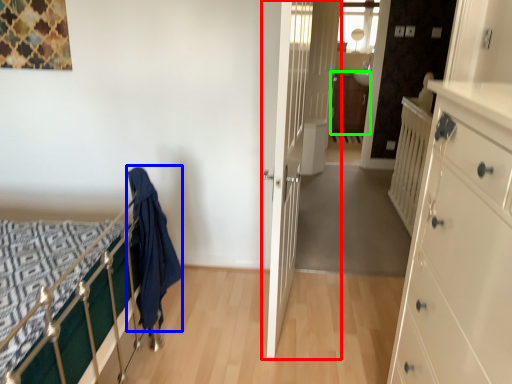
Question: Estimate the real-world distances between objects in this image. Which object is closer to door (highlighted by a red box), cloth (highlighted by a blue box) or file cabinet (highlighted by a green box)?

Choices:
 (A) cloth
 (B) file cabinet

Answer: (B)